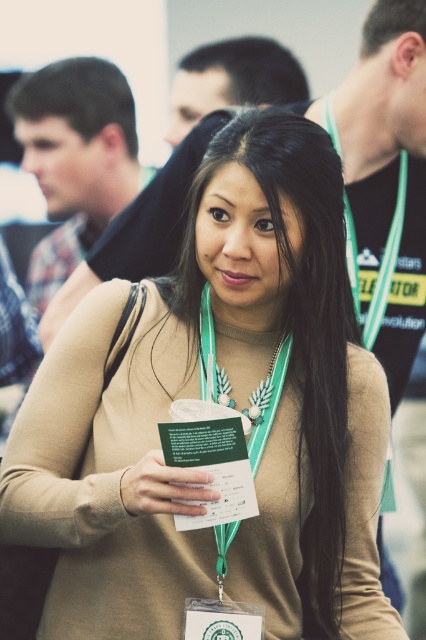
Based on the scene description, can you determine which object is positioned higher between the dark brown hair at upper left and the green fabric lanyard at right?

The green fabric lanyard at right is positioned higher because it is taller than the dark brown hair at upper left.